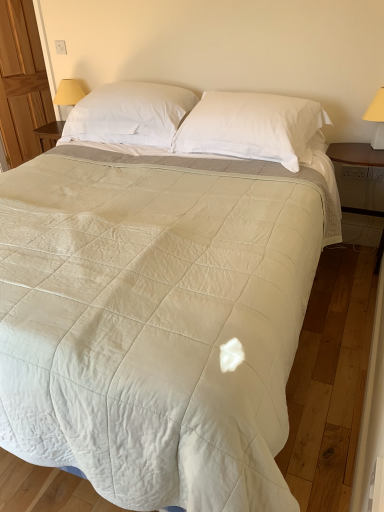
Image resolution: width=384 pixels, height=512 pixels. Identify the location of vacant space to the left of yellow fabric lampshade at right, positioned as the first table lamp in front-to-back order. (346, 151).